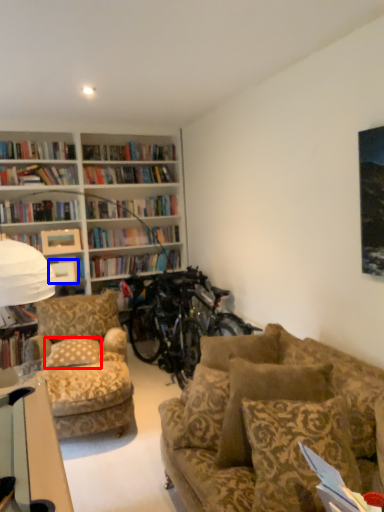
Question: Which of the following is the closest to the observer, pillow (highlighted by a red box) or picture frame (highlighted by a blue box)?

Choices:
 (A) pillow
 (B) picture frame

Answer: (A)